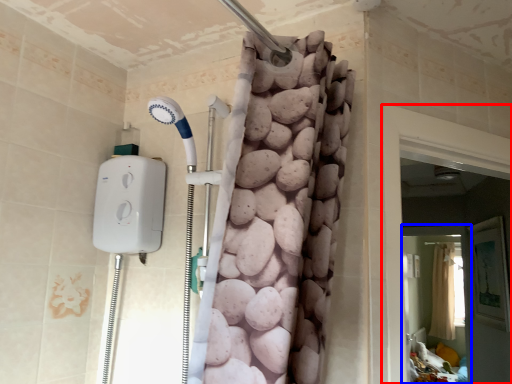
Question: Which object appears closest to the camera in this image, screen door (highlighted by a red box) or screen door (highlighted by a blue box)?

Choices:
 (A) screen door
 (B) screen door

Answer: (A)